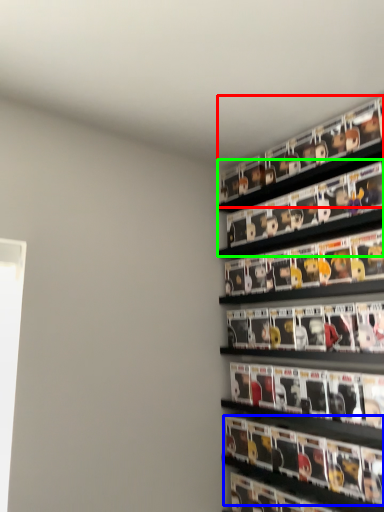
Question: Which object is the closest to the shelf (highlighted by a red box)? Choose among these: magazine (highlighted by a blue box) or shelf (highlighted by a green box).

Choices:
 (A) magazine
 (B) shelf

Answer: (B)